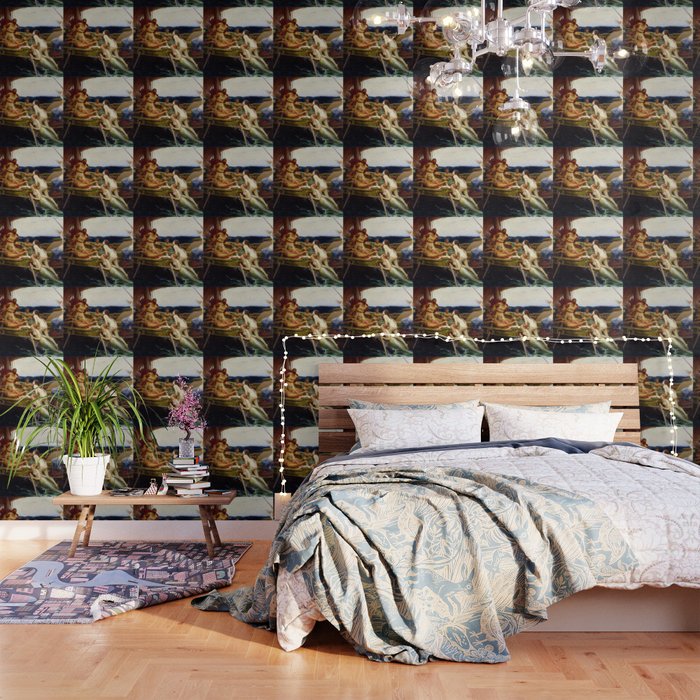
You are a GUI agent. You are given a task and a screenshot of the screen. Output one action in this format:
    pyautogui.click(x=<x>, y=<y>)
    Task: Click on the plant
    The height and width of the screenshot is (700, 700).
    Given the screenshot: What is the action you would take?
    pyautogui.click(x=84, y=419)